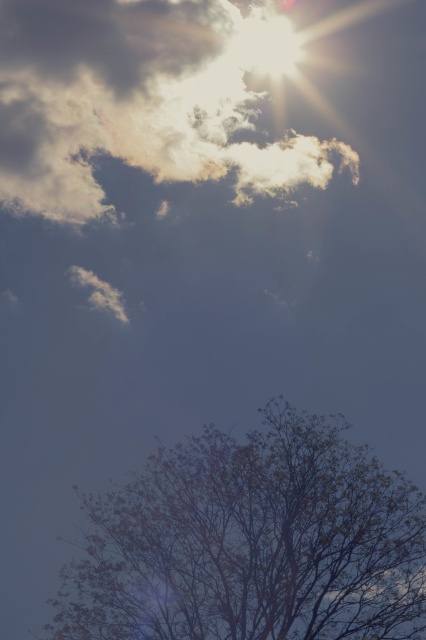
Is bare branches at lower right to the right of white fluffy cloud at upper center from the viewer's perspective?

Yes, bare branches at lower right is to the right of white fluffy cloud at upper center.

Is bare branches at lower right closer to the viewer compared to white fluffy cloud at upper center?

Yes, bare branches at lower right is in front of white fluffy cloud at upper center.

Measure the distance between point (160, 467) and camera.

Point (160, 467) is 31.45 meters away from camera.

At what (x,y) coordinates should I click in order to perform the action: click on bare branches at lower right. Please return your answer as a coordinate pair (x, y). The height and width of the screenshot is (640, 426). Looking at the image, I should click on (252, 541).